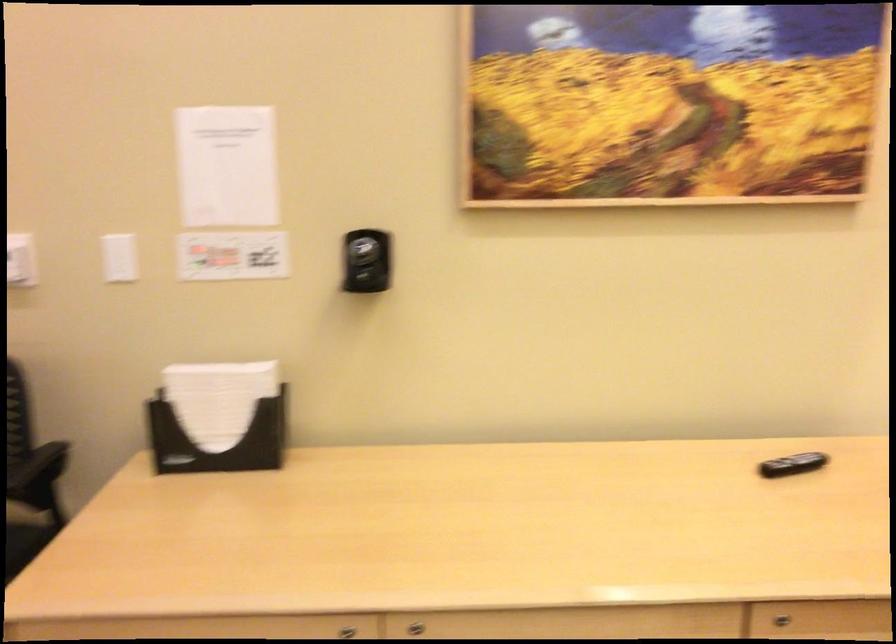
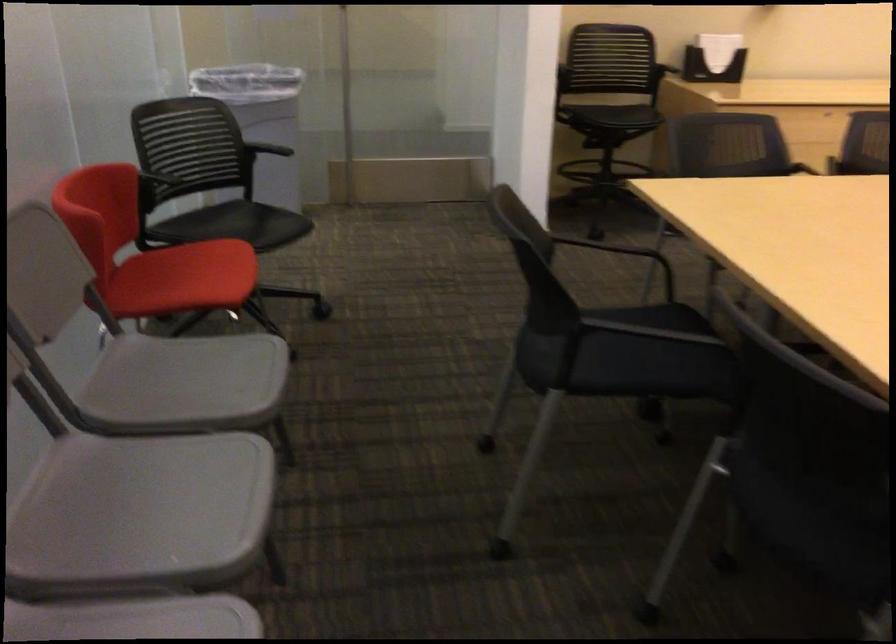
The images are taken continuously from a first-person perspective. In which direction are you moving?

The cameraman walked toward left, backward.